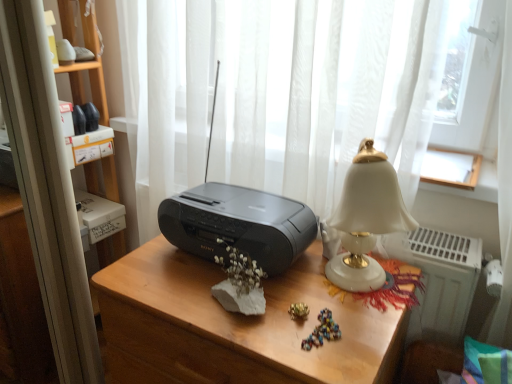
In the scene shown: What is the approximate width of white porcelain lamp at right?

white porcelain lamp at right is 8.72 inches wide.

At what (x,y) coordinates should I click in order to perform the action: click on black plastic printer at center. Please return your answer as a coordinate pair (x, y). Looking at the image, I should click on (238, 224).

How many degrees apart are the facing directions of matte black radio at center and white sheer curtain at center?

There is a 0.989-degree angle between the facing directions of matte black radio at center and white sheer curtain at center.

Is matte black radio at center situated inside white sheer curtain at center or outside?

matte black radio at center lies outside white sheer curtain at center.

Considering the relative positions of matte black radio at center and white sheer curtain at center in the image provided, is matte black radio at center to the left of white sheer curtain at center from the viewer's perspective?

In fact, matte black radio at center is to the right of white sheer curtain at center.

Based on the photo, are matte black radio at center and white sheer curtain at center located far from each other?

Actually, matte black radio at center and white sheer curtain at center are a little close together.

Can you tell me how much black plastic stereo at center and black plastic printer at center differ in facing direction?

0.106 degrees separate the facing orientations of black plastic stereo at center and black plastic printer at center.

Between black plastic stereo at center and black plastic printer at center, which one has larger size?

With larger size is black plastic stereo at center.

Considering the positions of points (286, 234) and (286, 237), is point (286, 234) closer to camera compared to point (286, 237)?

That is False.

From a real-world perspective, which object rests below the other?

From a 3D spatial view, black plastic printer at center is below.

At what (x,y) coordinates should I click in order to perform the action: click on printer above the matte black radio at center (from the image's perspective). Please return your answer as a coordinate pair (x, y). The width and height of the screenshot is (512, 384). Looking at the image, I should click on (238, 224).

Between point (310, 218) and point (199, 334), which one is positioned behind?

The point (310, 218) is farther.

Considering the sizes of objects black plastic printer at center and matte black radio at center in the image provided, who is thinner, black plastic printer at center or matte black radio at center?

black plastic printer at center is thinner.

Is black plastic printer at center facing away from matte black radio at center?

No, black plastic printer at center's orientation is not away from matte black radio at center.

Is black plastic printer at center oriented towards white sheer curtain at center?

A: No.

Locate an element on the screen. This screenshot has width=512, height=384. printer behind the white sheer curtain at center is located at coordinates (238, 224).

Is white sheer curtain at center surrounded by black plastic printer at center?

Definitely not — white sheer curtain at center is not inside black plastic printer at center.

Based on the photo, which of these two, black plastic printer at center or white sheer curtain at center, is wider?

white sheer curtain at center.

From the image's perspective, between white sheer curtain at center and black plastic stereo at center, who is located below?

white sheer curtain at center.

Find the location of a particular element. stereo lying on the left of white sheer curtain at center is located at coordinates pyautogui.click(x=238, y=222).

From the picture: Which is more to the left, matte black radio at center or black plastic stereo at center?

From the viewer's perspective, black plastic stereo at center appears more on the left side.

Is matte black radio at center wider or thinner than black plastic stereo at center?

Clearly, matte black radio at center has more width compared to black plastic stereo at center.

Considering the sizes of matte black radio at center and black plastic stereo at center in the image, is matte black radio at center bigger or smaller than black plastic stereo at center?

Considering their sizes, matte black radio at center takes up more space than black plastic stereo at center.

Does white porcelain lamp at right appear on the right side of black plastic printer at center?

Indeed, white porcelain lamp at right is positioned on the right side of black plastic printer at center.

Between white porcelain lamp at right and black plastic printer at center, which one is positioned behind?

black plastic printer at center is behind.

Between white porcelain lamp at right and black plastic printer at center, which one has larger size?

With larger size is white porcelain lamp at right.

What's the angular difference between white porcelain lamp at right and black plastic printer at center's facing directions?

The angle between the facing direction of white porcelain lamp at right and the facing direction of black plastic printer at center is 0.106 degrees.

Locate an element on the screen. The image size is (512, 384). curtain lying on the left of matte black radio at center is located at coordinates point(324,91).

The width and height of the screenshot is (512, 384). I want to click on printer behind the black plastic stereo at center, so click(238, 224).

Considering their positions, is white sheer curtain at center positioned further to black plastic printer at center than white porcelain lamp at right?

white sheer curtain at center is further to black plastic printer at center.

Based on their spatial positions, is black plastic stereo at center or black plastic printer at center further from matte black radio at center?

The object further to matte black radio at center is black plastic stereo at center.

Which object lies nearer to the anchor point black plastic printer at center, black plastic stereo at center or white porcelain lamp at right?

Based on the image, black plastic stereo at center appears to be nearer to black plastic printer at center.

From the image, which object appears to be farther from black plastic stereo at center, matte black radio at center or white porcelain lamp at right?

white porcelain lamp at right is further to black plastic stereo at center.

Based on their spatial positions, is black plastic stereo at center or matte black radio at center further from white sheer curtain at center?

matte black radio at center lies further to white sheer curtain at center than the other object.

Estimate the real-world distances between objects in this image. Which object is further from white sheer curtain at center, matte black radio at center or black plastic stereo at center?

matte black radio at center lies further to white sheer curtain at center than the other object.

Looking at the image, which one is located further to black plastic printer at center, white porcelain lamp at right or matte black radio at center?

Among the two, white porcelain lamp at right is located further to black plastic printer at center.

Looking at the image, which one is located further to black plastic printer at center, white porcelain lamp at right or white sheer curtain at center?

The object further to black plastic printer at center is white sheer curtain at center.

Locate an element on the screen. The image size is (512, 384). printer between white sheer curtain at center and matte black radio at center in the vertical direction is located at coordinates (238, 224).

This screenshot has height=384, width=512. I want to click on printer between black plastic stereo at center and matte black radio at center in the up-down direction, so click(x=238, y=224).

Locate an element on the screen. This screenshot has height=384, width=512. printer between white porcelain lamp at right and matte black radio at center in the vertical direction is located at coordinates (238, 224).

The width and height of the screenshot is (512, 384). Identify the location of curtain located between black plastic stereo at center and white porcelain lamp at right in the left-right direction. (324, 91).